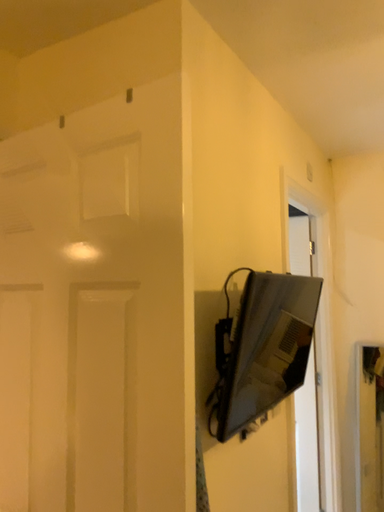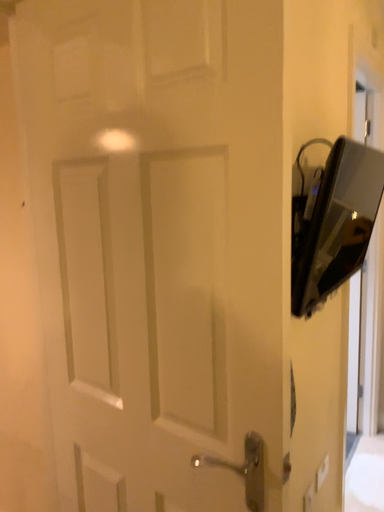
Question: How did the camera likely rotate when shooting the video?

Choices:
 (A) rotated downward
 (B) rotated upward

Answer: (A)